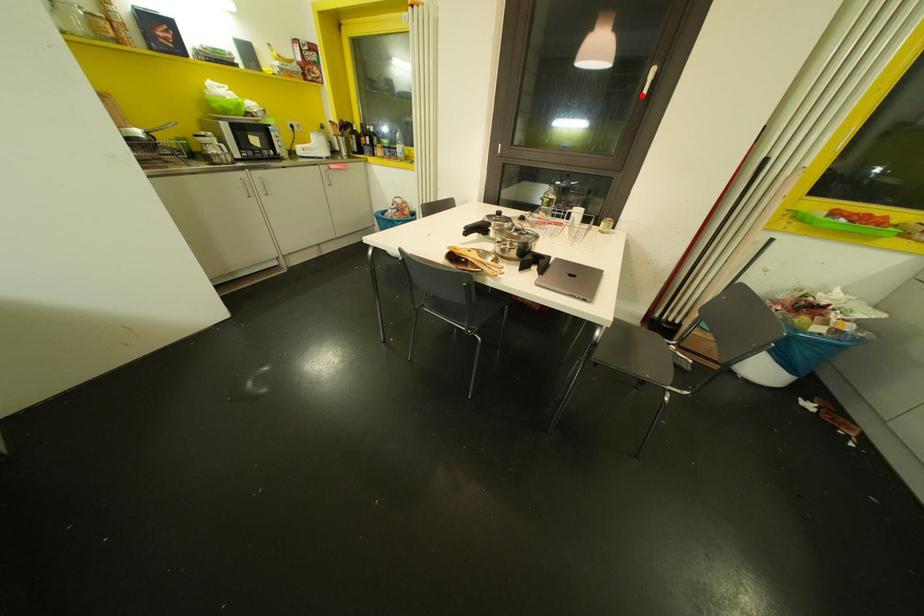
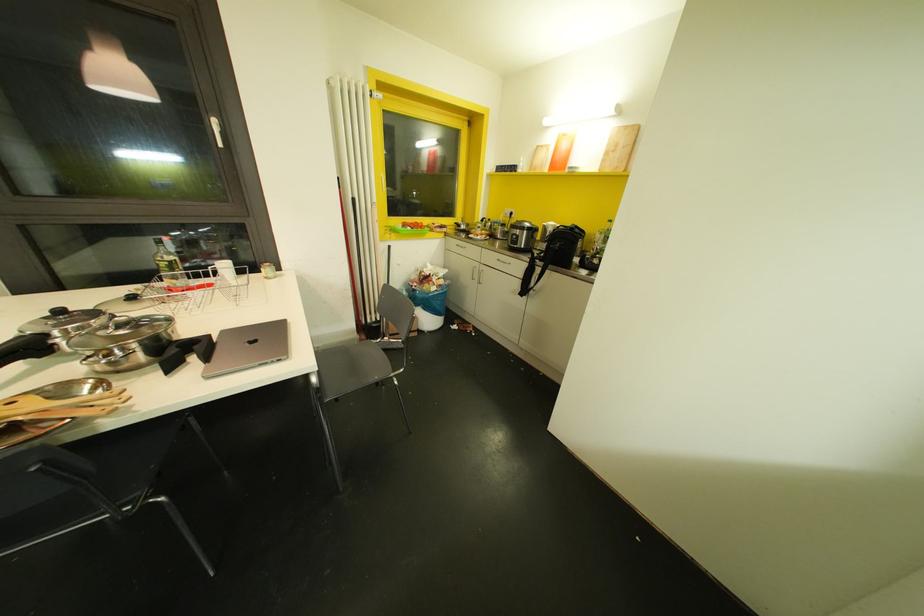
The point at the highlighted location is marked in the first image. Where is the corresponding point in the second image?

(220, 145)